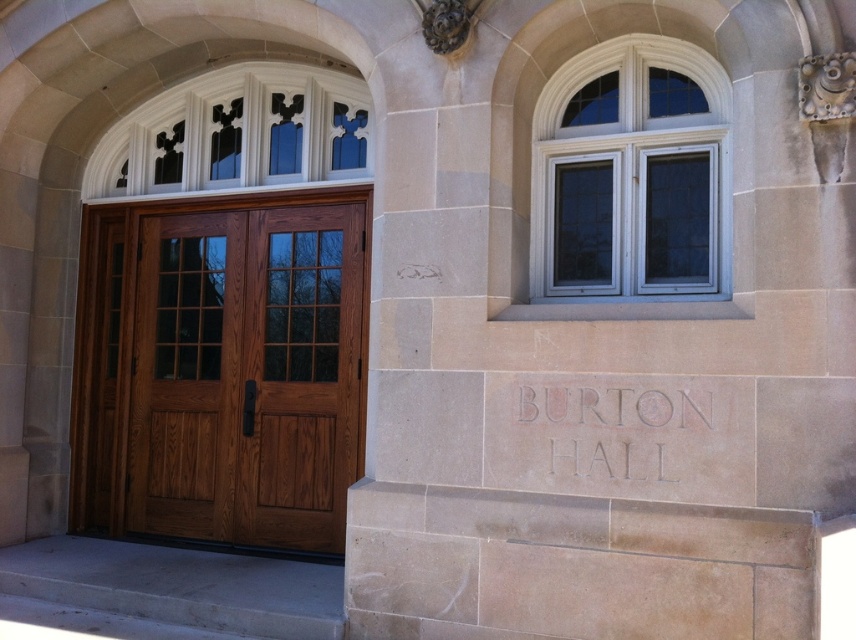
Question: Estimate the real-world distances between objects in this image. Which object is closer to the beige stone pillar at center?

Choices:
 (A) mahogany wood door at center
 (B) carved stone text at center

Answer: (B)

Question: Which object appears closest to the camera in this image?

Choices:
 (A) beige stone pillar at center
 (B) carved stone text at center

Answer: (A)

Question: In this image, where is mahogany wood door at center located relative to carved stone text at center?

Choices:
 (A) left
 (B) right

Answer: (A)

Question: Is beige stone pillar at center above carved stone text at center?

Choices:
 (A) no
 (B) yes

Answer: (B)

Question: Which of the following is the farthest from the observer?

Choices:
 (A) carved stone text at center
 (B) mahogany wood door at center

Answer: (B)

Question: From the image, what is the correct spatial relationship of beige stone pillar at center in relation to mahogany wood door at center?

Choices:
 (A) left
 (B) right

Answer: (B)